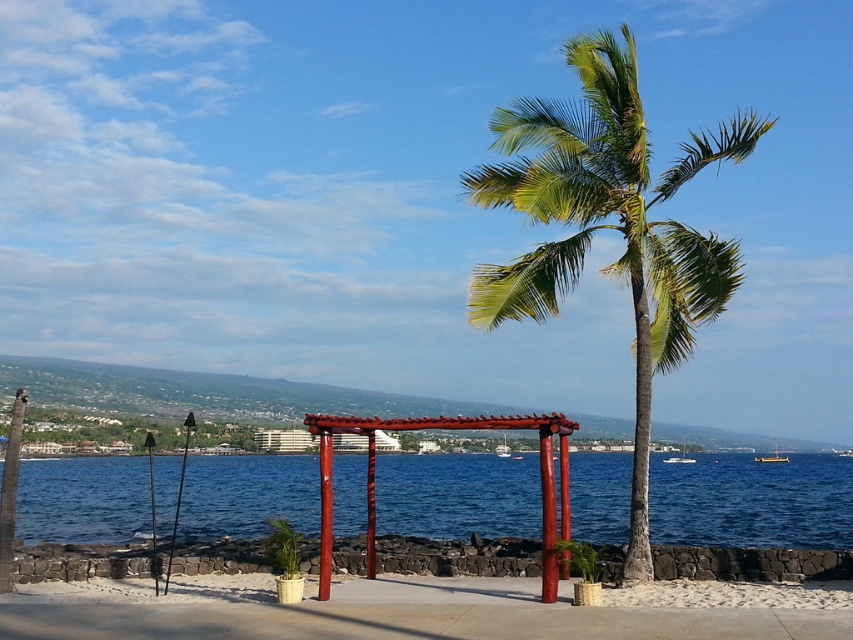
You are standing on the paved area near the red wooden archway. You see the blue water at center and the green leafy palm tree at center. Which one is closer to you?

The blue water at center is closer to you because it is in front of the green leafy palm tree at center.

You are standing on the paved area near the red wooden archway in the center. You want to walk to the blue water at center. Which direction should you go?

You should walk forward towards the blue water at center, which is located at point (752, 500). Since the blue water at center is at the center of the image, moving forward from the archway would lead you directly toward it.